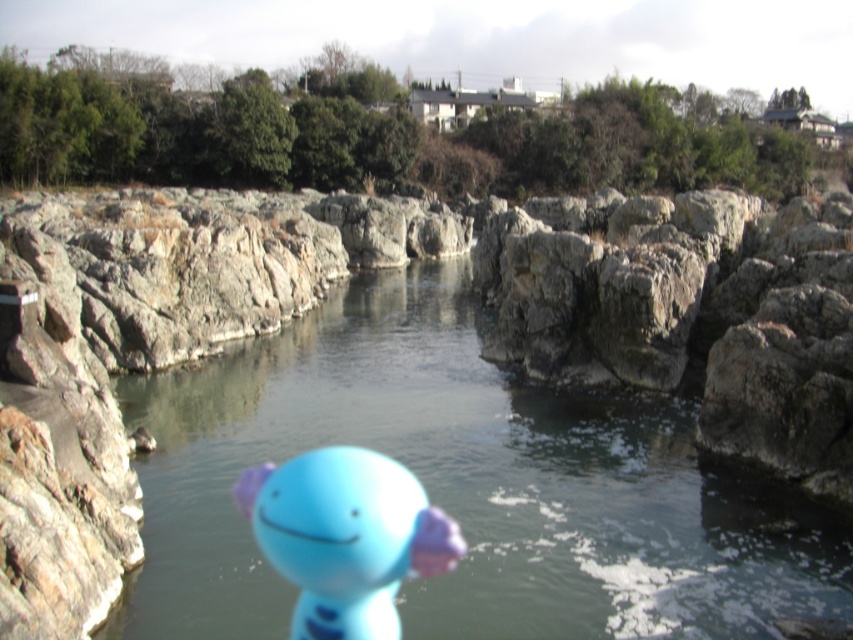
You are a photographer trying to capture the transparent plastic river at center in the image. Where exactly should you focus your camera to ensure it is in sharp focus?

You should focus your camera at point (466, 486) to ensure the transparent plastic river at center is in sharp focus.

You are a hiker who wants to cross the transparent plastic river at center to reach the other side. There is a matte blue plush toy at center nearby. Which direction should you go relative to the toy to find the river?

The transparent plastic river at center is to the right of the matte blue plush toy at center, so you should go to the right of the matte blue plush toy at center to find the river.